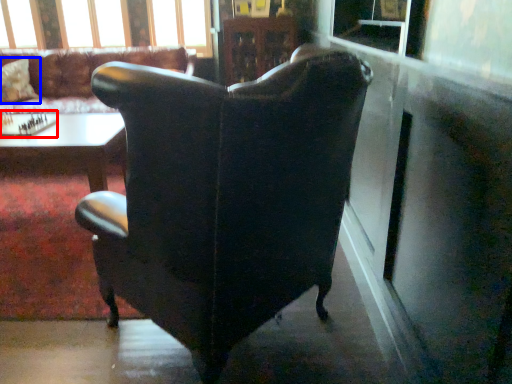
Question: Which point is closer to the camera, board game (highlighted by a red box) or pillow (highlighted by a blue box)?

Choices:
 (A) board game
 (B) pillow

Answer: (A)